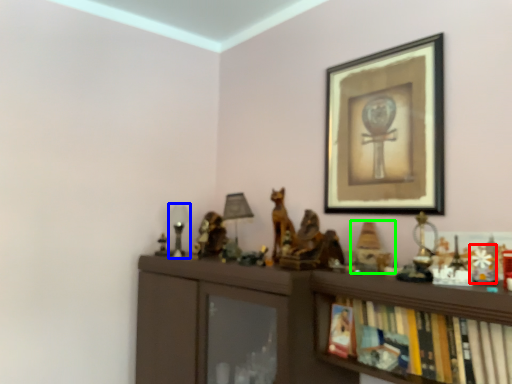
Question: Which object is positioned farthest from toy (highlighted by a red box)? Select from table lamp (highlighted by a blue box) and toy (highlighted by a green box).

Choices:
 (A) table lamp
 (B) toy

Answer: (A)